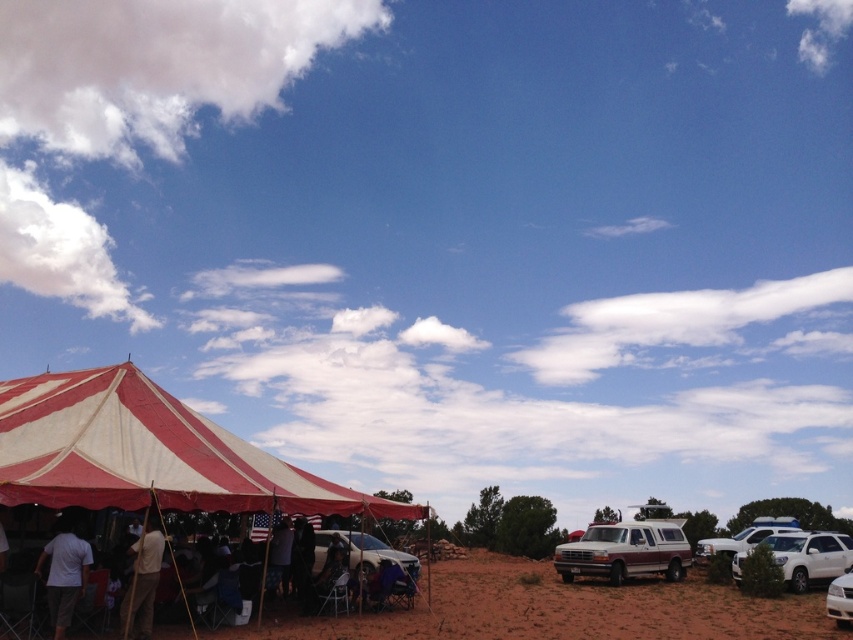
You are planning to park your car in the parking lot near the event. You see the rustic wood pickup truck at lower right and the white glossy sedan at lower right. Which vehicle is closer to the entrance of the tent?

The rustic wood pickup truck at lower right is positioned on the left side of white glossy sedan at lower right. Since the pickup truck is to the left of the sedan, it is closer to the entrance of the tent.

You are a guest at the event under the red and white striped tent at lower left and you need to reach the white matte police car at right. Given that the distance between them is 22.79 meters, how many steps would you estimate it would take if each of your steps is about 0.75 meters?

The distance between the red and white striped tent at lower left and the white matte police car at right is 22.79 meters. If each step is 0.75 meters, dividing 22.79 by 0.75 gives approximately 30.39 steps. Therefore, it would take roughly 30 steps to walk from the red and white striped tent at lower left to the white matte police car at right.

You are standing at the edge of the dirt area where the vehicles are parked. You want to walk directly to the point marked as point (273, 497). How far will you have to walk?

The point (273, 497) is 15.05 meters away from the viewer, so you will have to walk 15.05 meters to reach it.